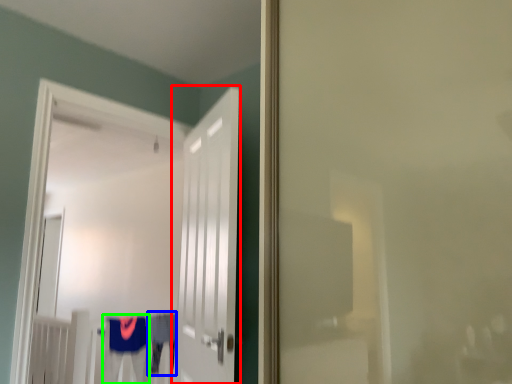
Question: Based on their relative distances, which object is farther from door (highlighted by a red box)? Choose from robe (highlighted by a blue box) and robe (highlighted by a green box).

Choices:
 (A) robe
 (B) robe

Answer: (A)